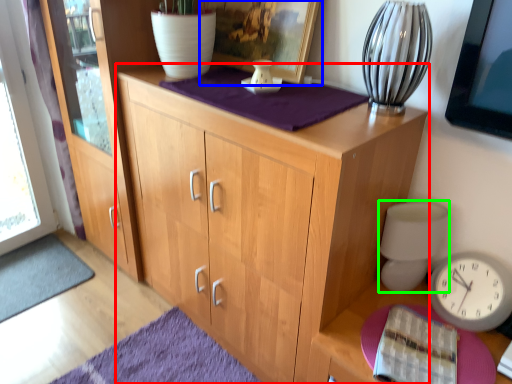
Question: Considering the real-world distances, which object is closest to cabinetry (highlighted by a red box)? picture frame (highlighted by a blue box) or table lamp (highlighted by a green box).

Choices:
 (A) picture frame
 (B) table lamp

Answer: (B)